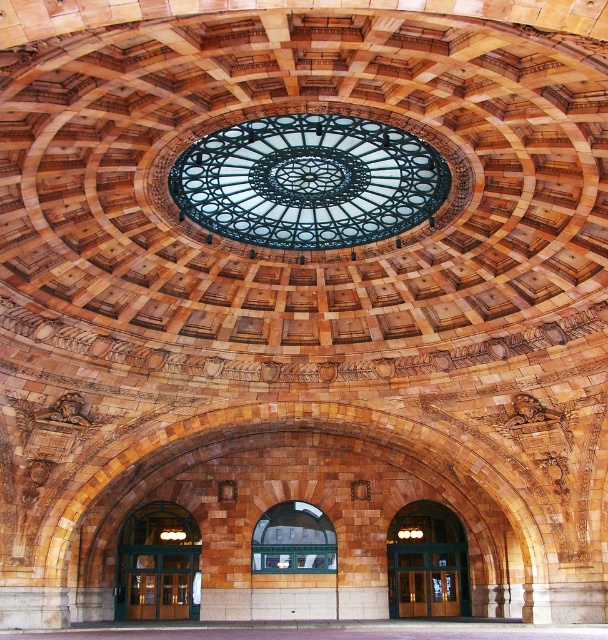
Question: Among these points, which one is farthest from the camera?

Choices:
 (A) (282, 506)
 (B) (451, 554)
 (C) (142, 577)

Answer: (A)

Question: Does clear glass dome at center have a smaller size compared to clear glass window at center?

Choices:
 (A) no
 (B) yes

Answer: (A)

Question: Which object is the closest to the green glass door at center?

Choices:
 (A) clear glass window at center
 (B) green glass doors at center
 (C) clear glass dome at center

Answer: (A)

Question: Observing the image, what is the correct spatial positioning of clear glass dome at center in reference to clear glass window at center?

Choices:
 (A) below
 (B) above

Answer: (B)

Question: Is green glass doors at center positioned behind green glass door at center?

Choices:
 (A) yes
 (B) no

Answer: (B)

Question: Which object is positioned farthest from the clear glass dome at center?

Choices:
 (A) green glass doors at center
 (B) clear glass window at center

Answer: (A)